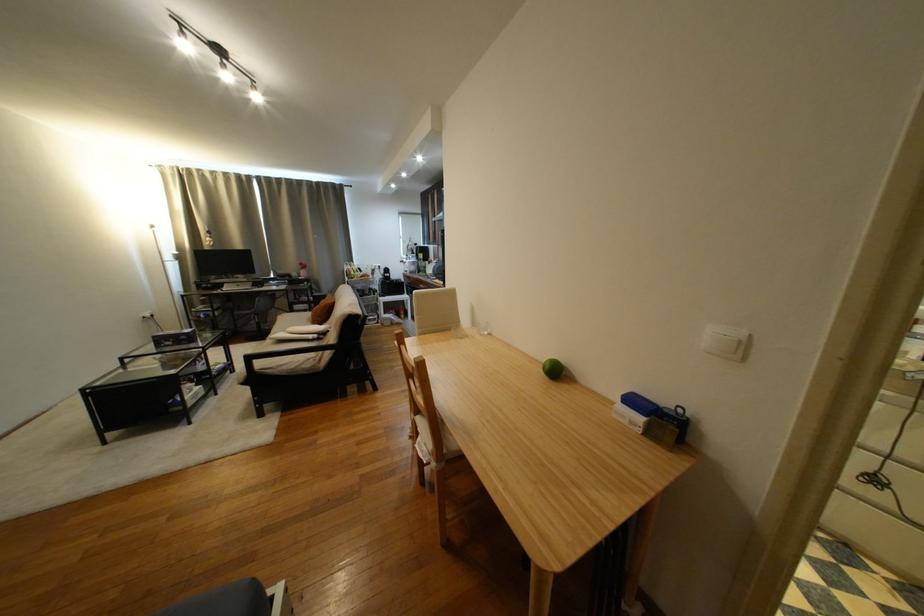
Image resolution: width=924 pixels, height=616 pixels. I want to click on brown throw pillow, so [x=322, y=310].